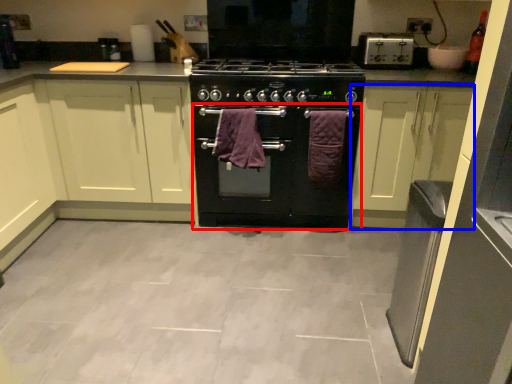
Question: Which point is further to the camera, oven (highlighted by a red box) or cabinetry (highlighted by a blue box)?

Choices:
 (A) oven
 (B) cabinetry

Answer: (A)